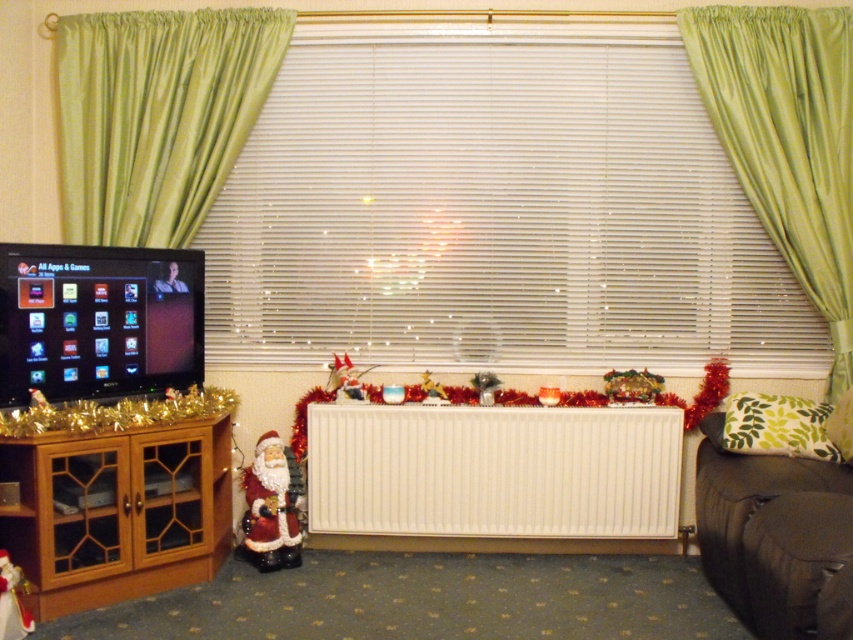
You are arranging holiday decorations and need to place a new ornament between the white plastic blinds at center and the wooden cabinet at left. Based on their positions, which object should the ornament be closer to?

The ornament should be placed closer to the wooden cabinet at left because the white plastic blinds at center are positioned to the right of the wooden cabinet at left.

Based on the photo, you are arranging holiday decorations and want to place a new ornament between the white plastic blinds at center and the green silk curtain at right. Based on their positions, which object should the ornament be closer to?

The ornament should be placed closer to the green silk curtain at right since the white plastic blinds at center is positioned on the left side of it.